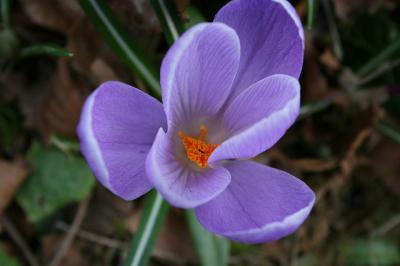
This screenshot has height=266, width=400. Identify the location of orchid. (210, 118).